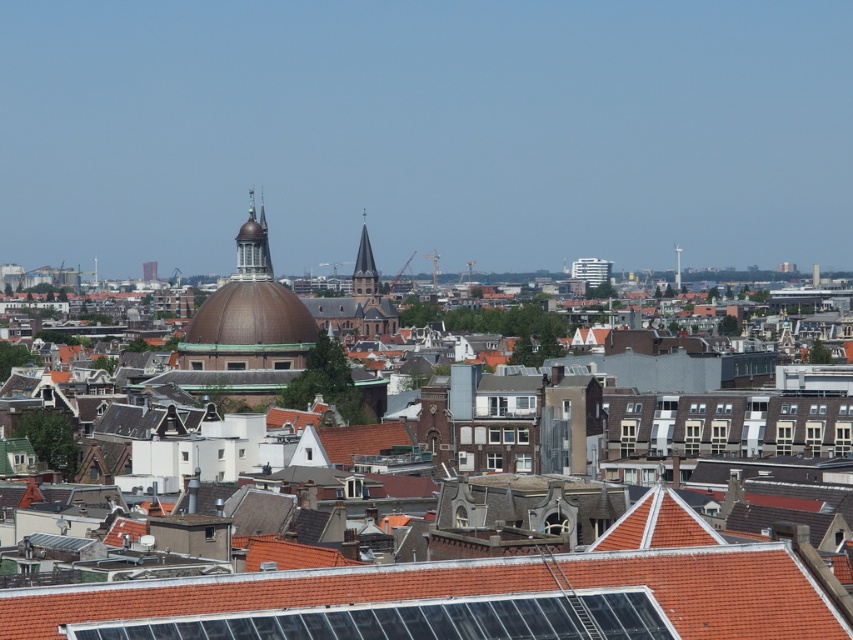
You are an architect analyzing the cityscape. Based on the image, which of the two structures, the red tile roof at center or the brown copper dome at center, has a larger footprint in terms of base area?

Answer: The brown copper dome at center has a larger footprint than the red tile roof at center because the red tile roof at center is smaller than the brown copper dome at center.

You are standing in the city and want to take a photo of both the red tile roof at center and the brown copper dome at center. Which object should you focus on first to ensure both are in sharp focus?

You should focus on the red tile roof at center first because it is closer to the viewer than the brown copper dome at center, so adjusting focus from near to far will help both be in sharp focus.

Based on the photo, you are standing at the edge of the city park and see the red tile roof at center in the distance. If you want to reach it within 2 minutes, what is the minimum speed you need to maintain? Assume you can walk directly towards it without obstacles.

The red tile roof at center is 70.61 meters away. To cover this distance in 2 minutes, you need to maintain a speed of approximately 0.59 meters per second, which is about 2.35 kilometers per hour.